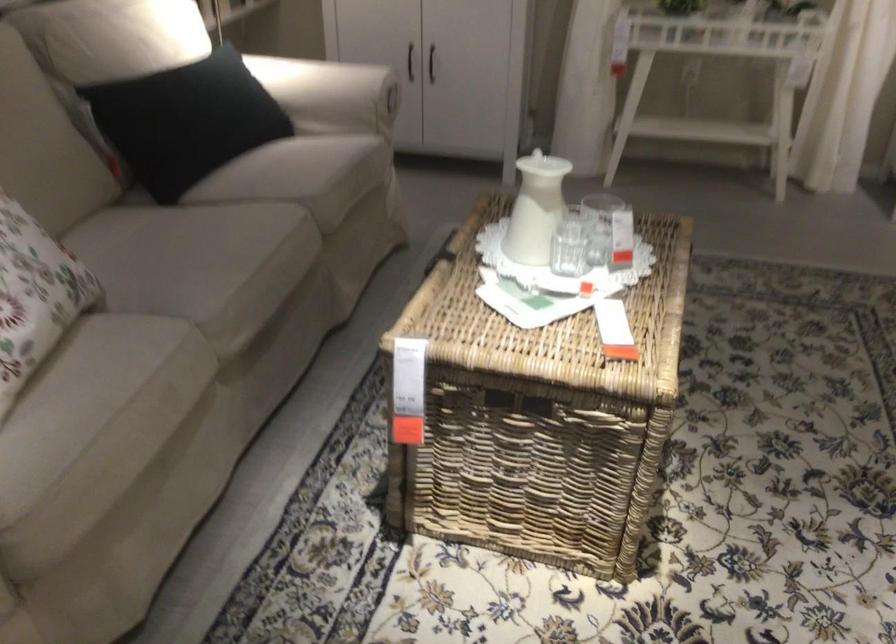
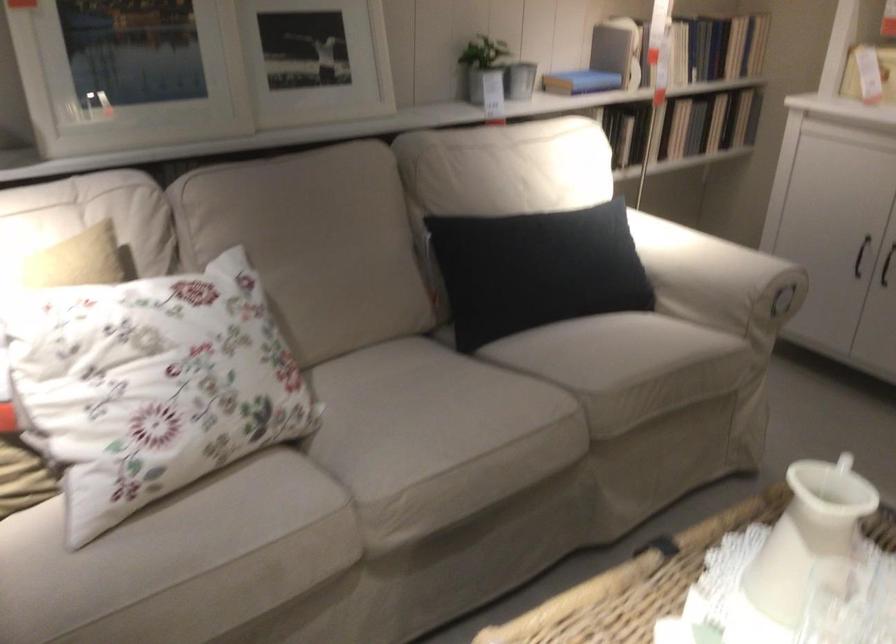
Where in the second image is the point corresponding to pixel 538 212 from the first image?

(803, 552)